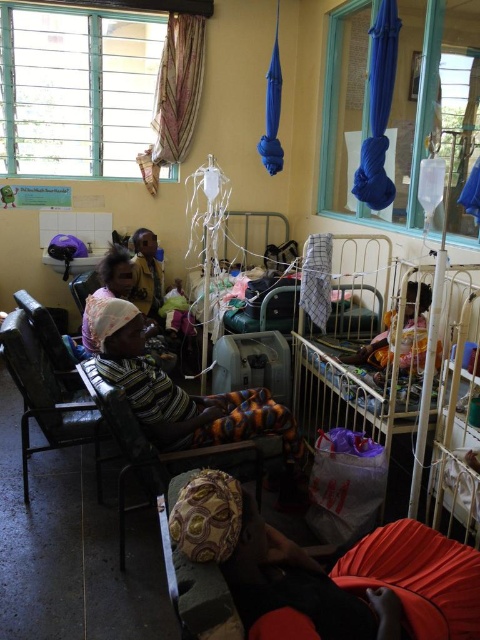
You are a nurse who needs to move a medical chart from the wooden fabric chair at center to the dark brown fabric at center. Can you place it directly without moving the chair?

The wooden fabric chair at center is in front of the dark brown fabric at center, so you can place the medical chart directly onto the dark brown fabric at center without moving the chair.